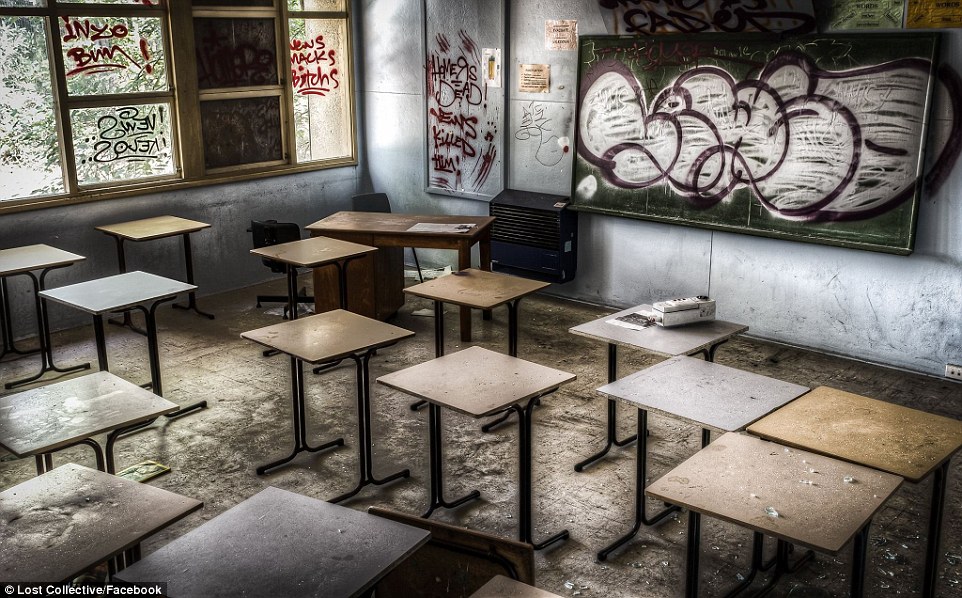
Locate an element on the screen. This screenshot has width=962, height=598. teacher's desk is located at coordinates (396, 221).